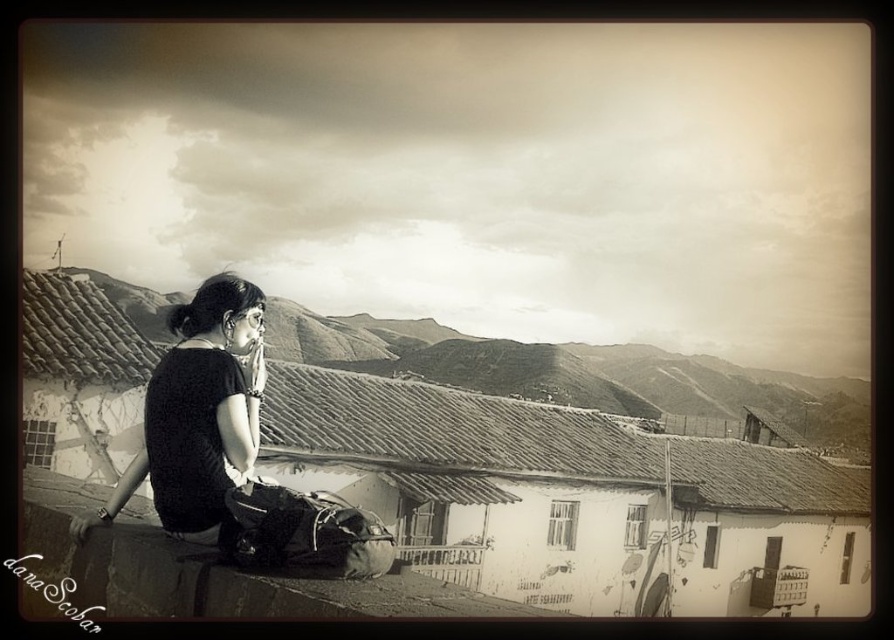
Question: Which object appears farthest from the camera in this image?

Choices:
 (A) black matte shirt at center
 (B) matte black backpack at lower center
 (C) smooth concrete ledge at lower left

Answer: (A)

Question: Which point is closer to the camera taking this photo?

Choices:
 (A) (361, 528)
 (B) (38, 500)
 (C) (250, 337)

Answer: (A)

Question: From the image, what is the correct spatial relationship of smooth concrete ledge at lower left in relation to black matte shirt at center?

Choices:
 (A) left
 (B) right

Answer: (B)

Question: Which point is closer to the camera?

Choices:
 (A) black matte shirt at center
 (B) smooth concrete ledge at lower left
 (C) matte black backpack at lower center

Answer: (B)

Question: Is smooth concrete ledge at lower left further to the viewer compared to matte black backpack at lower center?

Choices:
 (A) yes
 (B) no

Answer: (B)

Question: Is black matte shirt at center smaller than matte black backpack at lower center?

Choices:
 (A) no
 (B) yes

Answer: (A)